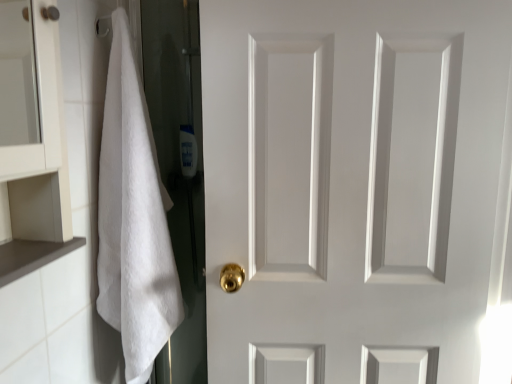
Question: Is brown matte cabinet at lower left spatially inside white fluffy towel at left, or outside of it?

Choices:
 (A) outside
 (B) inside

Answer: (A)

Question: From a real-world perspective, is brown matte cabinet at lower left positioned above or below white fluffy towel at left?

Choices:
 (A) above
 (B) below

Answer: (A)

Question: Which is farther from the brown matte cabinet at lower left?

Choices:
 (A) translucent plastic bottle at center
 (B) white fluffy towel at left
 (C) white matte door at center

Answer: (A)

Question: Based on their relative distances, which object is farther from the white fluffy towel at left?

Choices:
 (A) white matte door at center
 (B) translucent plastic bottle at center
 (C) brown matte cabinet at lower left

Answer: (B)